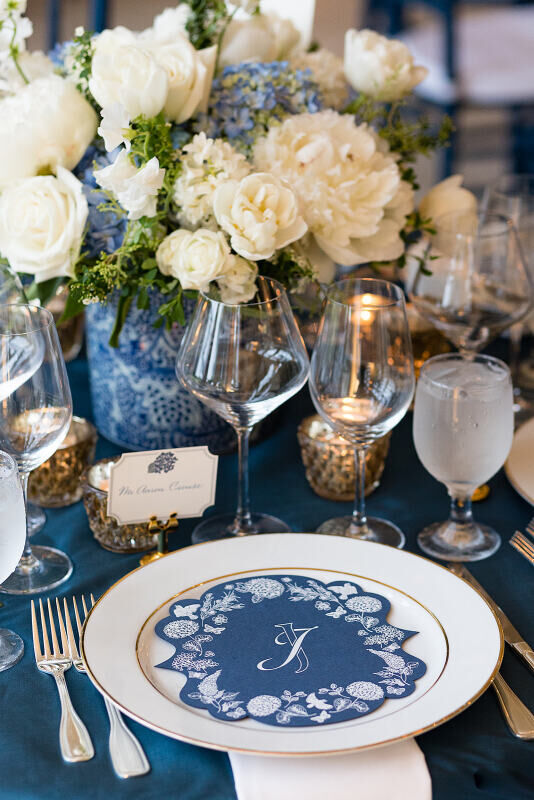
You are a GUI agent. You are given a task and a screenshot of the screen. Output one action in this format:
    pyautogui.click(x=<x>, y=<y>)
    Task: Click on the napkin
    The height and width of the screenshot is (800, 534).
    Given the screenshot: What is the action you would take?
    pyautogui.click(x=354, y=774)